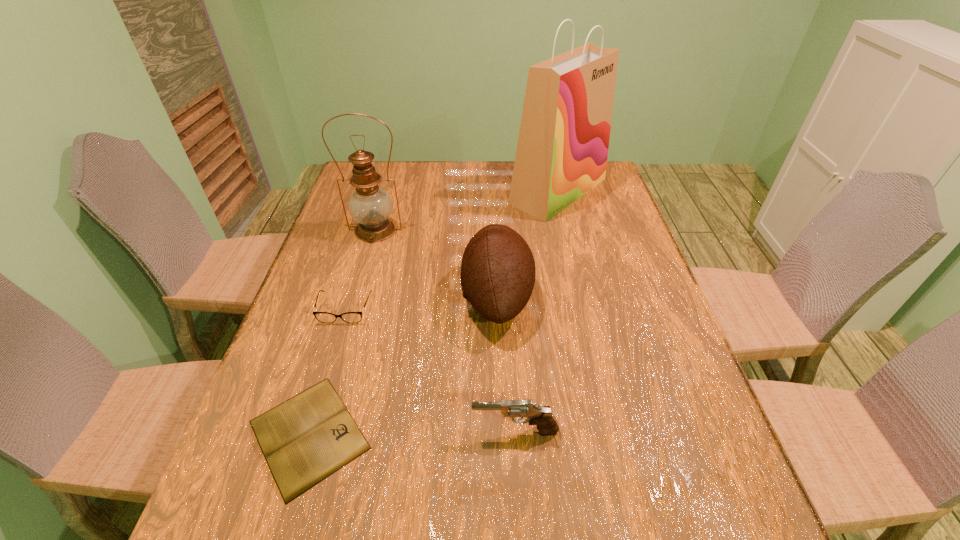
Where is `object that is at the right edge`? object that is at the right edge is located at coordinates (562, 149).

The image size is (960, 540). I want to click on object that is at the far right corner, so click(x=562, y=149).

This screenshot has height=540, width=960. Find the location of `vacant space at the far edge of the desktop`. vacant space at the far edge of the desktop is located at coordinates (457, 180).

The image size is (960, 540). I want to click on free spot at the left edge of the desktop, so click(x=313, y=291).

This screenshot has height=540, width=960. Identify the location of vacant region at the right edge of the desktop. (604, 314).

Where is `blank region between the spectacles and the third shortest object`? Image resolution: width=960 pixels, height=540 pixels. blank region between the spectacles and the third shortest object is located at coordinates (430, 370).

The image size is (960, 540). Find the location of `free space between the third tallest object and the book`. free space between the third tallest object and the book is located at coordinates (403, 366).

Where is `vacant space in between the tallest object and the football`? This screenshot has width=960, height=540. vacant space in between the tallest object and the football is located at coordinates (528, 244).

In order to click on free space that is in between the spectacles and the shopping bag in this screenshot , I will do `click(451, 250)`.

This screenshot has height=540, width=960. What are the coordinates of `free spot between the oil lamp and the shopping bag` in the screenshot? It's located at (467, 211).